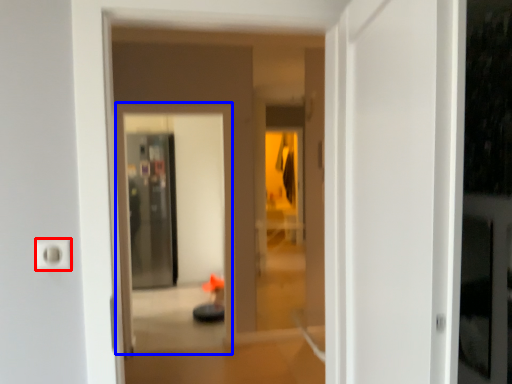
Question: Which object appears closest to the camera in this image, electric outlet (highlighted by a red box) or screen door (highlighted by a blue box)?

Choices:
 (A) electric outlet
 (B) screen door

Answer: (A)